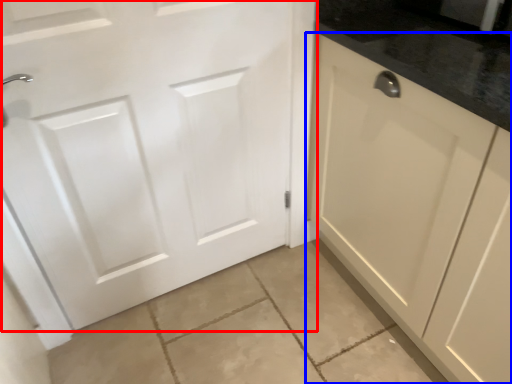
Question: Which object is closer to the camera taking this photo, door (highlighted by a red box) or cabinetry (highlighted by a blue box)?

Choices:
 (A) door
 (B) cabinetry

Answer: (B)